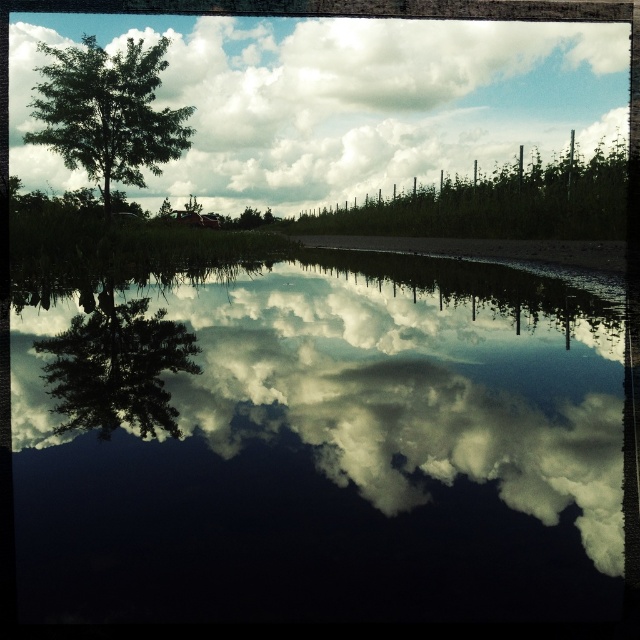
Question: In this image, where is cloudy sky at upper center located relative to green matte tree at upper left?

Choices:
 (A) below
 (B) above

Answer: (B)

Question: Does cloudy sky at upper center appear under green leafy plant at upper center?

Choices:
 (A) yes
 (B) no

Answer: (B)

Question: Is glossy reflective water at center smaller than green matte tree at center?

Choices:
 (A) no
 (B) yes

Answer: (A)

Question: Which of the following is the closest to the observer?

Choices:
 (A) green matte tree at upper left
 (B) green leafy plant at upper center

Answer: (B)

Question: Which point appears closest to the camera in this image?

Choices:
 (A) (116, 93)
 (B) (188, 211)
 (C) (244, 211)
 (D) (593, 168)

Answer: (A)

Question: Which object appears farthest from the camera in this image?

Choices:
 (A) green leafy plant at upper center
 (B) green leafy tree at upper left
 (C) green matte tree at upper left
 (D) cloudy sky at upper center

Answer: (C)